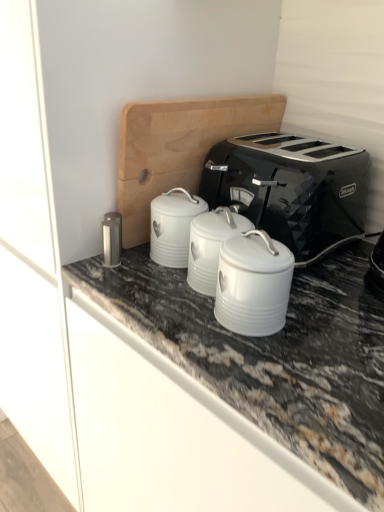
Question: From the image's perspective, is black metallic toaster at center located beneath white ceramic canister at center, the third appliance in the left-to-right sequence?

Choices:
 (A) no
 (B) yes

Answer: (A)

Question: Is the position of black metallic toaster at center more distant than that of white ceramic canister at center, the first appliance viewed from the right?

Choices:
 (A) yes
 (B) no

Answer: (A)

Question: From the image's perspective, does black metallic toaster at center appear higher than white ceramic canister at center, the third appliance in the left-to-right sequence?

Choices:
 (A) no
 (B) yes

Answer: (B)

Question: From a real-world perspective, is black metallic toaster at center over white ceramic canister at center, the first appliance viewed from the right?

Choices:
 (A) yes
 (B) no

Answer: (A)

Question: Does black metallic toaster at center have a greater height compared to white ceramic canister at center, the first appliance viewed from the right?

Choices:
 (A) no
 (B) yes

Answer: (B)

Question: From a real-world perspective, is satin silver canister at center-left, which ranks as the first appliance in left-to-right order, above or below white enameled canister at center, the 2th appliance when ordered from right to left?

Choices:
 (A) above
 (B) below

Answer: (B)

Question: Considering the positions of satin silver canister at center-left, which ranks as the first appliance in left-to-right order, and white enameled canister at center, the 2th appliance when ordered from right to left, in the image, is satin silver canister at center-left, which ranks as the first appliance in left-to-right order, taller or shorter than white enameled canister at center, the 2th appliance when ordered from right to left,?

Choices:
 (A) tall
 (B) short

Answer: (B)

Question: Is satin silver canister at center-left, marked as the third appliance in a right-to-left arrangement, inside the boundaries of white enameled canister at center, which appears as the 2th appliance when viewed from the left, or outside?

Choices:
 (A) outside
 (B) inside

Answer: (A)

Question: Is point (114, 264) closer or farther from the camera than point (238, 232)?

Choices:
 (A) farther
 (B) closer

Answer: (A)

Question: From the image's perspective, is white ceramic canister at center, the first appliance viewed from the right, positioned above or below satin silver canister at center-left, marked as the third appliance in a right-to-left arrangement?

Choices:
 (A) below
 (B) above

Answer: (A)

Question: From a real-world perspective, relative to satin silver canister at center-left, marked as the third appliance in a right-to-left arrangement, is white ceramic canister at center, the first appliance viewed from the right, vertically above or below?

Choices:
 (A) above
 (B) below

Answer: (A)

Question: In the image, is white ceramic canister at center, the third appliance in the left-to-right sequence, on the left side or the right side of satin silver canister at center-left, which ranks as the first appliance in left-to-right order?

Choices:
 (A) right
 (B) left

Answer: (A)

Question: Is white ceramic canister at center, the third appliance in the left-to-right sequence, inside the boundaries of satin silver canister at center-left, which ranks as the first appliance in left-to-right order, or outside?

Choices:
 (A) outside
 (B) inside

Answer: (A)

Question: From the image's perspective, is satin silver canister at center-left, which ranks as the first appliance in left-to-right order, located above or below black metallic toaster at center?

Choices:
 (A) below
 (B) above

Answer: (A)

Question: From a real-world perspective, is satin silver canister at center-left, marked as the third appliance in a right-to-left arrangement, above or below black metallic toaster at center?

Choices:
 (A) above
 (B) below

Answer: (B)